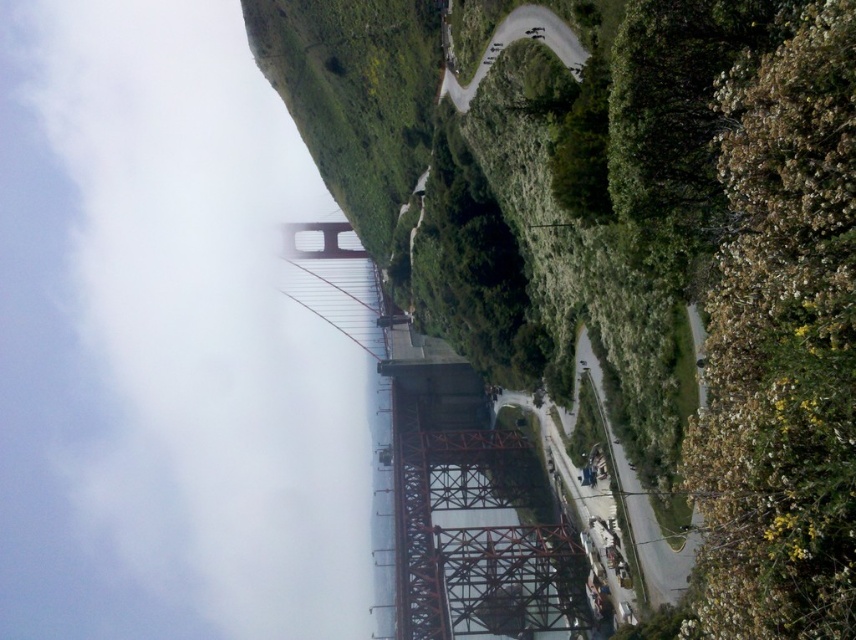
You are a photographer planning to capture the Golden Gate Bridge with a focus on the white fluffy cloud at upper left. Given that your camera has a fixed focal point at point (165,342), will the cloud be centered in your photo?

The white fluffy cloud at upper left is located at point (165,342), which matches the camera focal point. Therefore, the cloud will be centered in the photo.

You are a photographer planning to capture the Golden Gate Bridge with both the white fluffy cloud at upper left and the green grassy hillside at upper center in the frame. Which object appears higher in the image?

The white fluffy cloud at upper left appears higher in the image than the green grassy hillside at upper center because it has a greater height compared to it.

You are a photographer planning to take a picture of the Golden Gate Bridge. You notice the white fluffy cloud at upper left and the green grassy hillside at upper center. Which object is located more to the left in the scene?

The white fluffy cloud at upper left is more to the left than the green grassy hillside at upper center.